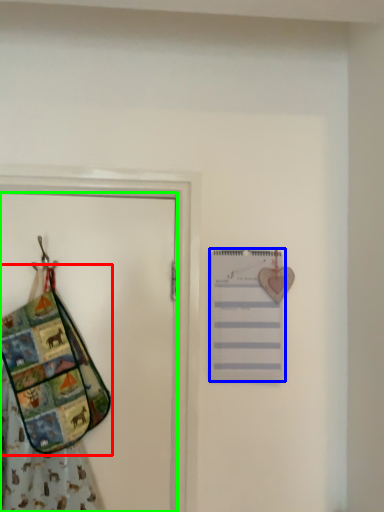
Question: Considering the real-world distances, which object is closest to handbag (highlighted by a red box)? list (highlighted by a blue box) or door (highlighted by a green box).

Choices:
 (A) list
 (B) door

Answer: (B)